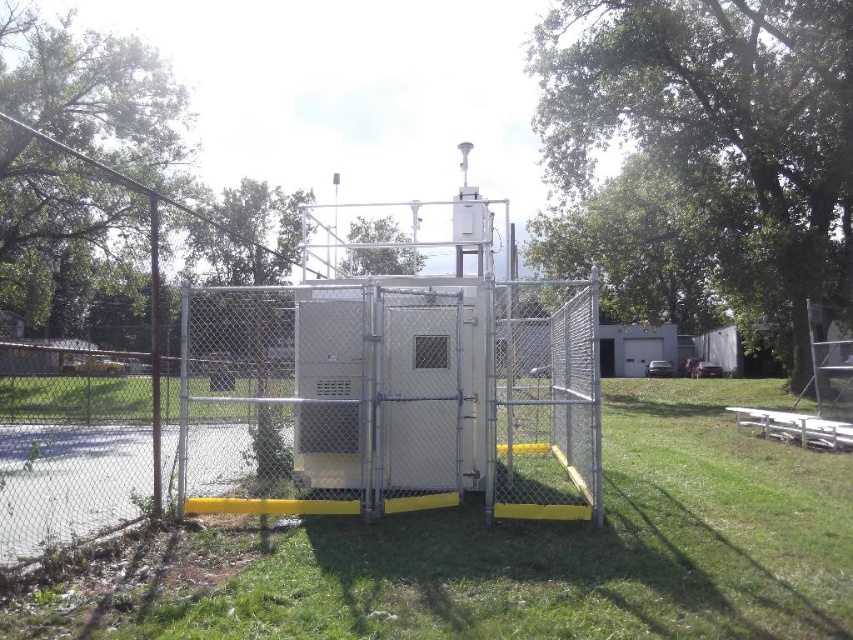
Question: Which point is closer to the camera?

Choices:
 (A) metallic gray cabinet at center
 (B) green grass at lower center

Answer: (B)

Question: Which of these objects is positioned farthest from the green grass at lower center?

Choices:
 (A) metal chain-link fence at center
 (B) metallic gray cabinet at center
 (C) white wooden picnic table at lower right

Answer: (A)

Question: Can you confirm if metallic gray cabinet at center is thinner than white wooden picnic table at lower right?

Choices:
 (A) yes
 (B) no

Answer: (B)

Question: In this image, where is metal chain-link fence at center located relative to metallic gray cabinet at center?

Choices:
 (A) above
 (B) below

Answer: (A)

Question: Does metal chain-link fence at center have a larger size compared to metallic gray cabinet at center?

Choices:
 (A) yes
 (B) no

Answer: (A)

Question: Estimate the real-world distances between objects in this image. Which object is farther from the metallic gray cabinet at center?

Choices:
 (A) white wooden picnic table at lower right
 (B) metal chain-link fence at center
 (C) green grass at lower center

Answer: (A)